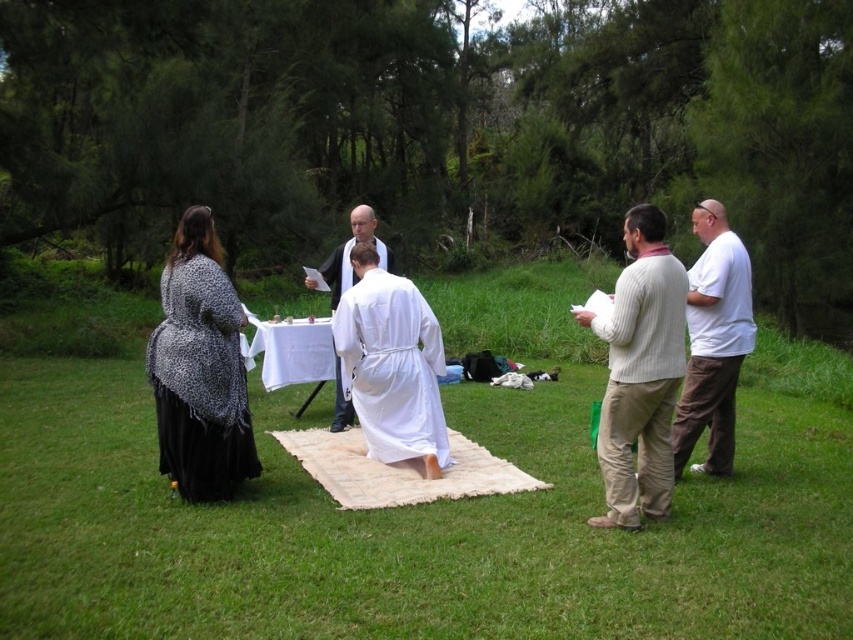
You are planning to take a photo of the group around the white table. To ensure both the white silk robe at center and the white cotton shirt at right are clearly visible, which one should you focus on first?

The white silk robe at center is below the white cotton shirt at right, so focusing on the white cotton shirt at right first will ensure both are in focus as the robe is closer to the camera.

You are a gardener who needs to place a 3 feet wide decorative stone between the green grass at center and leopard print fabric at left. Can you fit it without overlapping either?

The distance between the green grass at center and leopard print fabric at left is 9.60 feet. Since the stone is only 3 feet wide, there is enough space to place it between them without overlapping either object.

You are standing in the grassy area looking at the scene. There are two points marked in the image, point 1 at coordinates point (236,465) and point 2 at coordinates point (712,372). Which point is closer to you?

Point (236,465) is closer to the camera than point (712,372), so point 1 is closer to you.